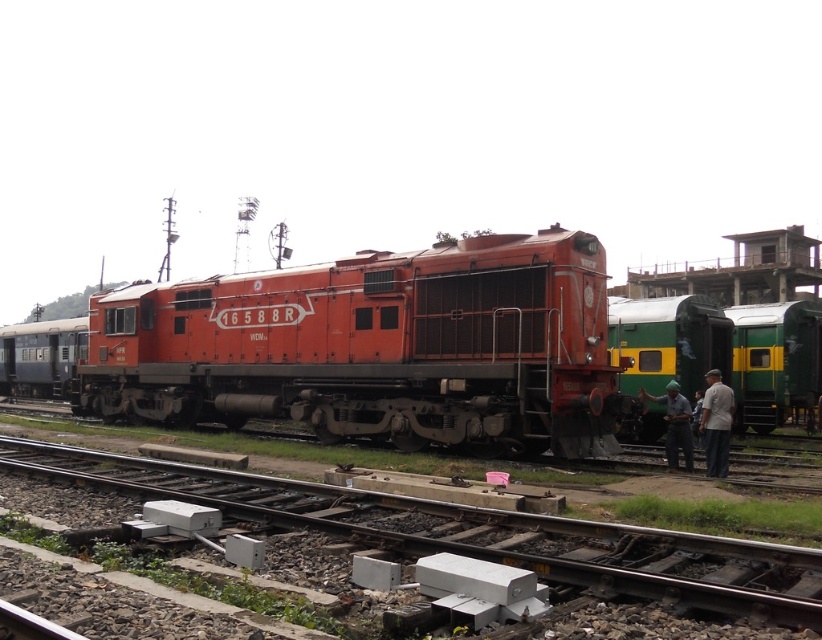
Who is more forward, (84, 451) or (668, 394)?

Point (668, 394) is in front.

Looking at this image, is metal at center thinner than green fabric cap at lower right?

In fact, metal at center might be wider than green fabric cap at lower right.

Measure the distance between metal at center and camera.

metal at center is 5.10 meters away from camera.

You are a GUI agent. You are given a task and a screenshot of the screen. Output one action in this format:
    pyautogui.click(x=<x>, y=<y>)
    Task: Click on the metal at center
    Image resolution: width=822 pixels, height=640 pixels.
    Given the screenshot: What is the action you would take?
    pyautogui.click(x=474, y=532)

Is the position of light gray fabric pants at lower right less distant than that of green fabric cap at lower right?

Yes, light gray fabric pants at lower right is in front of green fabric cap at lower right.

Is light gray fabric pants at lower right further to the viewer compared to green fabric cap at lower right?

No, it is in front of green fabric cap at lower right.

Between point (714, 417) and point (686, 404), which one is positioned behind?

Positioned behind is point (686, 404).

Where is `light gray fabric pants at lower right`? This screenshot has height=640, width=822. light gray fabric pants at lower right is located at coordinates (716, 422).

Is matte orange locomotive at center above light gray fabric pants at lower right?

Indeed, matte orange locomotive at center is positioned over light gray fabric pants at lower right.

From the picture: Who is taller, matte orange locomotive at center or light gray fabric pants at lower right?

matte orange locomotive at center

What do you see at coordinates (373, 348) in the screenshot? I see `matte orange locomotive at center` at bounding box center [373, 348].

At what (x,y) coordinates should I click in order to perform the action: click on matte orange locomotive at center. Please return your answer as a coordinate pair (x, y). The width and height of the screenshot is (822, 640). Looking at the image, I should click on tap(373, 348).